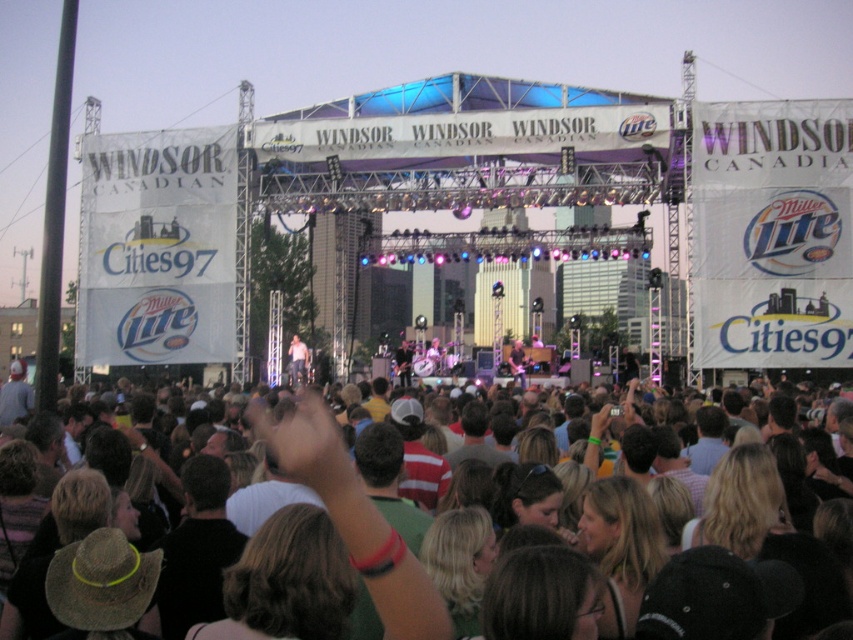
You are a photographer at the concert and want to capture a clear shot of both the dark brown hair at center and the light brown leather jacket at center. Which object should you focus on first to ensure both are in the frame?

The dark brown hair at center is located below the light brown leather jacket at center, so you should focus on the light brown leather jacket at center first to ensure both are in the frame.

From the picture: You are a photographer at the concert trying to capture the performer. You notice the dark brown hair at center and the light brown leather jacket at center. Which object should you focus on to ensure it appears larger in your photo?

The dark brown hair at center is larger in size than the light brown leather jacket at center, so focusing on the dark brown hair at center will make it appear larger in the photo.

You are standing at the center of the stage and want to move towards the crowd. Which point, point (619, 563) or point (297, 346), is closer to the crowd?

Point (619, 563) is closer to the camera than point (297, 346). Since you want to move towards the crowd, which is in front of the stage, the closer point to the camera would be farther from the crowd. Therefore, point (297, 346) is closer to the crowd.